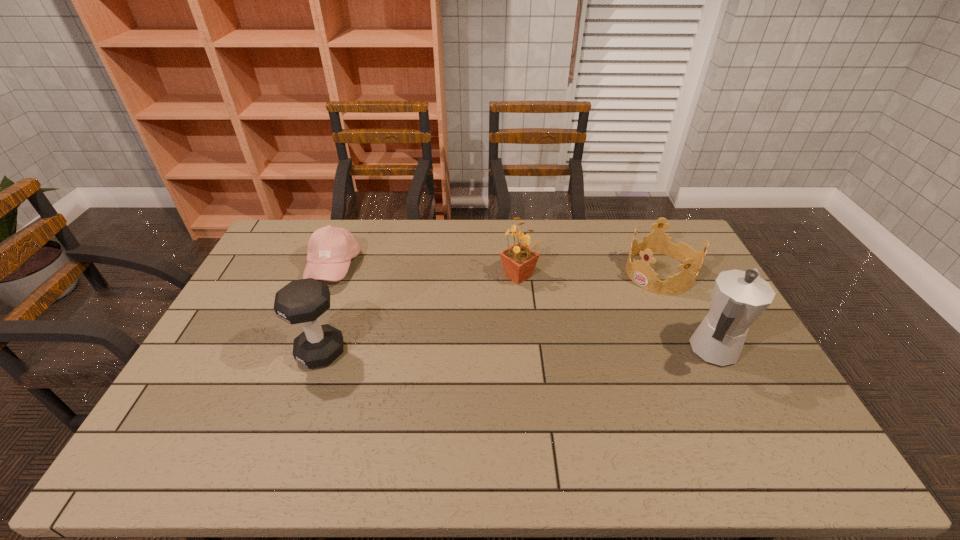
Identify the location of object present at the far right corner. (640, 272).

Identify the location of vacant space at the far edge of the desktop. (404, 224).

In the image, there is a desktop. Where is `vacant space at the near edge`? This screenshot has height=540, width=960. vacant space at the near edge is located at coordinates (582, 421).

Identify the location of free region at the left edge. [x=280, y=269].

In the image, there is a desktop. Find the location of `free region at the right edge`. free region at the right edge is located at coordinates (750, 355).

In order to click on free space at the far left corner in this screenshot , I will do `click(269, 245)`.

The height and width of the screenshot is (540, 960). I want to click on free space at the far right corner of the desktop, so click(673, 242).

Find the location of a particular element. free area in between the tiara and the baseball cap is located at coordinates (496, 270).

Find the location of a particular element. Image resolution: width=960 pixels, height=540 pixels. unoccupied area between the tallest object and the sunflower is located at coordinates (614, 314).

Identify the location of empty space that is in between the third object from right to left and the baseball cap. Image resolution: width=960 pixels, height=540 pixels. (425, 272).